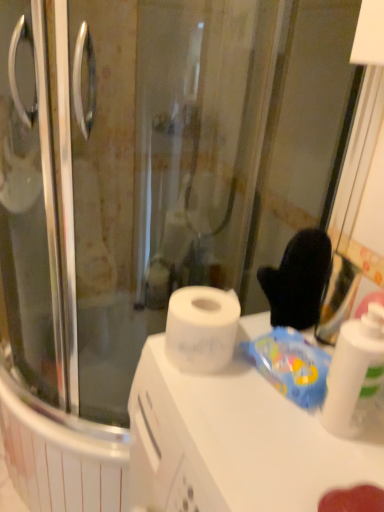
Locate an element on the screen. This screenshot has height=512, width=384. free space in front of white glossy bottle at right is located at coordinates (332, 470).